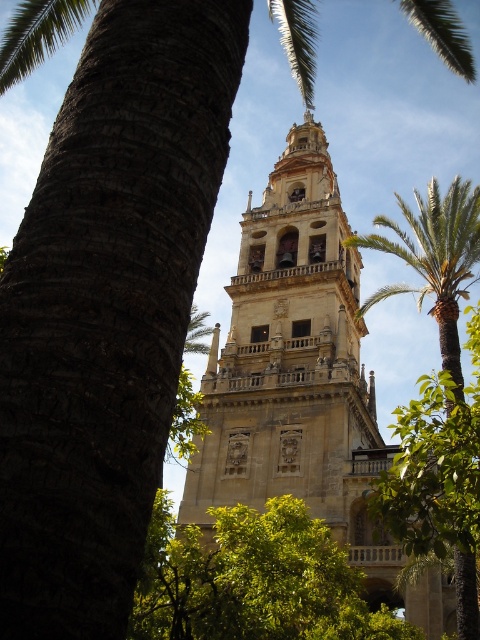
Question: Is beige stone tower at center positioned in front of green leafy palm at center?

Choices:
 (A) yes
 (B) no

Answer: (B)

Question: Does green leafy tree at center have a lesser width compared to green leafy palm at center?

Choices:
 (A) no
 (B) yes

Answer: (B)

Question: Considering the real-world distances, which object is closest to the green leafy palm at center?

Choices:
 (A) beige stone tower at center
 (B) green leafy tree at center

Answer: (A)

Question: Can you confirm if green leafy tree at center is positioned above green leafy palm at center?

Choices:
 (A) no
 (B) yes

Answer: (A)

Question: Which point appears closest to the camera in this image?

Choices:
 (A) (351, 362)
 (B) (479, 259)
 (C) (412, 628)

Answer: (C)

Question: Which of the following is the farthest from the observer?

Choices:
 (A) green leafy palm at center
 (B) green leafy tree at center
 (C) beige stone tower at center

Answer: (C)